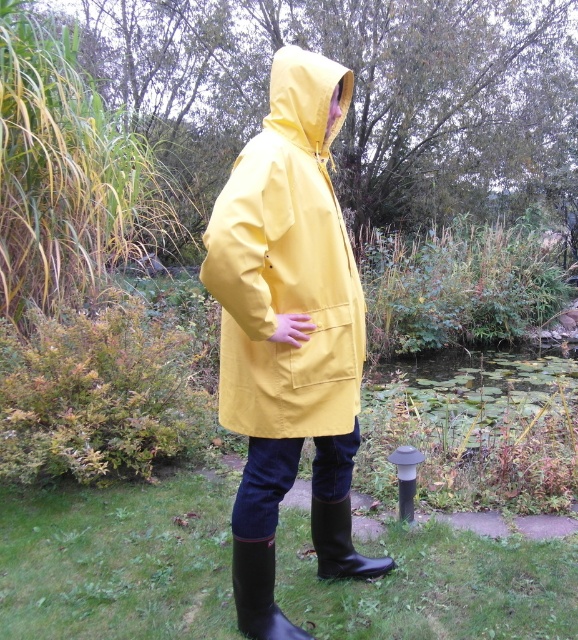
Question: Is yellow matte raincoat at center wider than rubber/matte boot at lower center?

Choices:
 (A) no
 (B) yes

Answer: (B)

Question: Which of the following is the farthest from the observer?

Choices:
 (A) yellow matte raincoat at center
 (B) yellow matte hood at upper center
 (C) rubber/matte boot at lower center

Answer: (B)

Question: Based on their relative distances, which object is nearer to the yellow matte raincoat at center?

Choices:
 (A) yellow matte hood at upper center
 (B) black rubber boot at lower center
 (C) rubber/matte boot at lower center

Answer: (A)

Question: Does yellow matte raincoat at center have a smaller size compared to rubber/matte boot at lower center?

Choices:
 (A) yes
 (B) no

Answer: (B)

Question: Can you confirm if yellow matte hood at upper center is thinner than rubber/matte boot at lower center?

Choices:
 (A) no
 (B) yes

Answer: (A)

Question: Which point is closer to the camera?

Choices:
 (A) rubber/matte boot at lower center
 (B) yellow matte raincoat at center
 (C) black rubber boot at lower center

Answer: (B)